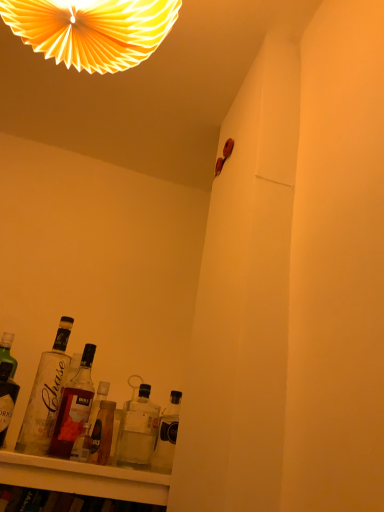
Question: Considering the relative sizes of clear glass bottle at lower left, marked as the 1th bottle in a left-to-right arrangement, and translucent glass bottle at lower center, the 2th bottle when ordered from right to left, in the image provided, is clear glass bottle at lower left, marked as the 1th bottle in a left-to-right arrangement, bigger than translucent glass bottle at lower center, the 2th bottle when ordered from right to left,?

Choices:
 (A) no
 (B) yes

Answer: (B)

Question: Is clear glass bottle at lower left, marked as the 1th bottle in a left-to-right arrangement, located outside translucent glass bottle at lower center, the 2th bottle when ordered from right to left?

Choices:
 (A) no
 (B) yes

Answer: (B)

Question: Is clear glass bottle at lower left, marked as the 1th bottle in a left-to-right arrangement, smaller than translucent glass bottle at lower center, the 2th bottle when ordered from right to left?

Choices:
 (A) yes
 (B) no

Answer: (B)

Question: Can you confirm if clear glass bottle at lower left, marked as the 1th bottle in a left-to-right arrangement, is shorter than translucent glass bottle at lower center, the 2th bottle when ordered from right to left?

Choices:
 (A) no
 (B) yes

Answer: (A)

Question: Is clear glass bottle at lower left, marked as the 1th bottle in a left-to-right arrangement, to the left of translucent glass bottle at lower center, arranged as the 4th bottle when viewed from the left, from the viewer's perspective?

Choices:
 (A) yes
 (B) no

Answer: (A)

Question: Is point (9, 14) closer or farther from the camera than point (155, 451)?

Choices:
 (A) closer
 (B) farther

Answer: (A)

Question: From a real-world perspective, is yellow paper fan at upper center above or below translucent glass bottle at lower right, acting as the fifth bottle starting from the left?

Choices:
 (A) below
 (B) above

Answer: (B)

Question: Is yellow paper fan at upper center wider or thinner than translucent glass bottle at lower right, marked as the 1th bottle in a right-to-left arrangement?

Choices:
 (A) thin
 (B) wide

Answer: (B)

Question: Choose the correct answer: Is yellow paper fan at upper center inside translucent glass bottle at lower right, acting as the fifth bottle starting from the left, or outside it?

Choices:
 (A) outside
 (B) inside

Answer: (A)

Question: From their relative heights in the image, would you say clear glass bottle at lower left, marked as the 1th bottle in a left-to-right arrangement, is taller or shorter than yellow paper fan at upper center?

Choices:
 (A) tall
 (B) short

Answer: (B)

Question: From the image's perspective, is clear glass bottle at lower left, marked as the 1th bottle in a left-to-right arrangement, located above or below yellow paper fan at upper center?

Choices:
 (A) above
 (B) below

Answer: (B)

Question: Based on their sizes in the image, would you say clear glass bottle at lower left, marked as the 1th bottle in a left-to-right arrangement, is bigger or smaller than yellow paper fan at upper center?

Choices:
 (A) big
 (B) small

Answer: (B)

Question: From a real-world perspective, is clear glass bottle at lower left, arranged as the 5th bottle when viewed from the right, physically located above or below yellow paper fan at upper center?

Choices:
 (A) above
 (B) below

Answer: (B)

Question: From the image's perspective, is translucent glass bottle at lower center, arranged as the 4th bottle when viewed from the left, located above or below clear glass bottle at lower left, positioned as the second bottle in left-to-right order?

Choices:
 (A) below
 (B) above

Answer: (A)

Question: Based on their sizes in the image, would you say translucent glass bottle at lower center, arranged as the 4th bottle when viewed from the left, is bigger or smaller than clear glass bottle at lower left, positioned as the 4th bottle in right-to-left order?

Choices:
 (A) big
 (B) small

Answer: (A)